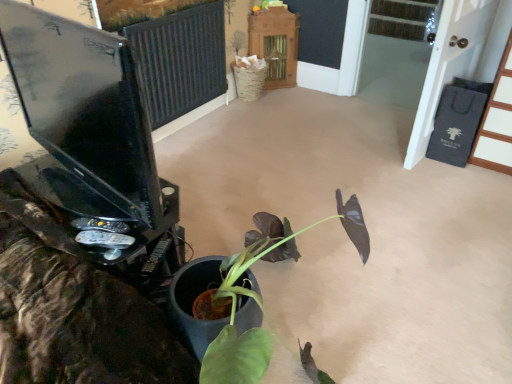
Image resolution: width=512 pixels, height=384 pixels. Describe the element at coordinates (497, 122) in the screenshot. I see `black wood door at upper right, which is the second furniture from back to front` at that location.

Locate an element on the screen. Image resolution: width=512 pixels, height=384 pixels. matte black monitor at left is located at coordinates (84, 105).

Consider the image. Is black wood door at upper right, the first furniture from the front, behind matte black monitor at left?

Yes, it is.

Is black wood door at upper right, which is the second furniture from back to front, at the right side of matte black monitor at left?

Correct, you'll find black wood door at upper right, which is the second furniture from back to front, to the right of matte black monitor at left.

From the image's perspective, between black wood door at upper right, the 1th furniture in the right-to-left sequence, and matte black monitor at left, who is located below?

matte black monitor at left is shown below in the image.

Which of these two, black wood door at upper right, placed as the second furniture when sorted from left to right, or matte black monitor at left, is smaller?

With smaller size is black wood door at upper right, placed as the second furniture when sorted from left to right.

Looking at this image, is wooden cabinet at upper center, positioned as the 2th furniture in front-to-back order, next to black fabric screen door at right and touching it?

No, wooden cabinet at upper center, positioned as the 2th furniture in front-to-back order, is not next to black fabric screen door at right.

In terms of size, does wooden cabinet at upper center, arranged as the first furniture when viewed from the left, appear bigger or smaller than black fabric screen door at right?

In the image, wooden cabinet at upper center, arranged as the first furniture when viewed from the left, appears to be smaller than black fabric screen door at right.

From a real-world perspective, who is located lower, wooden cabinet at upper center, positioned as the 2th furniture in front-to-back order, or black fabric screen door at right?

wooden cabinet at upper center, positioned as the 2th furniture in front-to-back order.

The image size is (512, 384). I want to click on screen door that appears on the right of wooden cabinet at upper center, arranged as the first furniture when viewed from the left, so click(459, 59).

Based on the photo, is black fabric screen door at right inside the boundaries of black wood door at upper right, placed as the second furniture when sorted from left to right, or outside?

black fabric screen door at right is spatially situated outside black wood door at upper right, placed as the second furniture when sorted from left to right.

Where is `furniture below the black fabric screen door at right (from the image's perspective)`? This screenshot has width=512, height=384. furniture below the black fabric screen door at right (from the image's perspective) is located at coordinates (497, 122).

Does black fabric screen door at right appear on the left side of black wood door at upper right, the 1th furniture in the right-to-left sequence?

Correct, you'll find black fabric screen door at right to the left of black wood door at upper right, the 1th furniture in the right-to-left sequence.

From a real-world perspective, which object rests below the other?

From a 3D spatial view, black wood door at upper right, which is the second furniture from back to front, is below.

Looking at this image, from the image's perspective, would you say matte black monitor at left is shown under black wood door at upper right, placed as the second furniture when sorted from left to right?

Yes, from the image's perspective, matte black monitor at left is beneath black wood door at upper right, placed as the second furniture when sorted from left to right.

Locate an element on the screen. This screenshot has width=512, height=384. computer monitor in front of the black wood door at upper right, the 1th furniture in the right-to-left sequence is located at coordinates (84, 105).

Considering the relative sizes of matte black monitor at left and black wood door at upper right, placed as the second furniture when sorted from left to right, in the image provided, is matte black monitor at left taller than black wood door at upper right, placed as the second furniture when sorted from left to right,?

No, matte black monitor at left is not taller than black wood door at upper right, placed as the second furniture when sorted from left to right.

Can we say matte black monitor at left lies outside black wood door at upper right, placed as the second furniture when sorted from left to right?

Absolutely, matte black monitor at left is external to black wood door at upper right, placed as the second furniture when sorted from left to right.

Looking at their sizes, would you say black wood door at upper right, which is the second furniture from back to front, is wider or thinner than black fabric screen door at right?

Clearly, black wood door at upper right, which is the second furniture from back to front, has more width compared to black fabric screen door at right.

Could black fabric screen door at right be considered to be inside black wood door at upper right, which is the second furniture from back to front?

No.

From the image's perspective, is black wood door at upper right, which is the second furniture from back to front, located above black fabric screen door at right?

No.

Find the location of a particular element. Image resolution: width=512 pixels, height=384 pixels. computer monitor in front of the wooden cabinet at upper center, arranged as the first furniture when viewed from the left is located at coordinates (84, 105).

Looking at the image, does matte black monitor at left seem bigger or smaller compared to wooden cabinet at upper center, arranged as the 2th furniture when viewed from the right?

Considering their sizes, matte black monitor at left takes up more space than wooden cabinet at upper center, arranged as the 2th furniture when viewed from the right.

Which is more to the left, matte black monitor at left or wooden cabinet at upper center, positioned as the 2th furniture in front-to-back order?

matte black monitor at left is more to the left.

From a real-world perspective, is matte black monitor at left over wooden cabinet at upper center, arranged as the 2th furniture when viewed from the right?

Yes, from a real-world perspective, matte black monitor at left is above wooden cabinet at upper center, arranged as the 2th furniture when viewed from the right.

From a real-world perspective, is wooden cabinet at upper center, marked as the 1th furniture in a back-to-front arrangement, physically above black wood door at upper right, placed as the second furniture when sorted from left to right?

Incorrect, from a real-world perspective, wooden cabinet at upper center, marked as the 1th furniture in a back-to-front arrangement, is lower than black wood door at upper right, placed as the second furniture when sorted from left to right.

Is the position of wooden cabinet at upper center, arranged as the first furniture when viewed from the left, less distant than that of black wood door at upper right, placed as the second furniture when sorted from left to right?

No, wooden cabinet at upper center, arranged as the first furniture when viewed from the left, is behind black wood door at upper right, placed as the second furniture when sorted from left to right.

How different are the orientations of wooden cabinet at upper center, arranged as the 2th furniture when viewed from the right, and black wood door at upper right, placed as the second furniture when sorted from left to right, in degrees?

wooden cabinet at upper center, arranged as the 2th furniture when viewed from the right, and black wood door at upper right, placed as the second furniture when sorted from left to right, are facing 35.1 degrees away from each other.

Does wooden cabinet at upper center, positioned as the 2th furniture in front-to-back order, have a greater height compared to black wood door at upper right, placed as the second furniture when sorted from left to right?

No, wooden cabinet at upper center, positioned as the 2th furniture in front-to-back order, is not taller than black wood door at upper right, placed as the second furniture when sorted from left to right.

Identify the location of computer monitor on the left of black wood door at upper right, the 1th furniture in the right-to-left sequence. (84, 105).

Identify the location of the 2nd furniture directly beneath the black fabric screen door at right (from a real-world perspective). This screenshot has width=512, height=384. (275, 44).

Consider the image. Looking at the image, which one is located closer to wooden cabinet at upper center, positioned as the 2th furniture in front-to-back order, black wood door at upper right, the 1th furniture in the right-to-left sequence, or matte black monitor at left?

black wood door at upper right, the 1th furniture in the right-to-left sequence, is closer to wooden cabinet at upper center, positioned as the 2th furniture in front-to-back order.

Considering their positions, is wooden cabinet at upper center, marked as the 1th furniture in a back-to-front arrangement, positioned further to matte black monitor at left than black fabric screen door at right?

wooden cabinet at upper center, marked as the 1th furniture in a back-to-front arrangement, is positioned further to the anchor matte black monitor at left.

Looking at the image, which one is located further to matte black monitor at left, black fabric screen door at right or wooden cabinet at upper center, arranged as the first furniture when viewed from the left?

The object further to matte black monitor at left is wooden cabinet at upper center, arranged as the first furniture when viewed from the left.

Based on their spatial positions, is black fabric screen door at right or matte black monitor at left closer to wooden cabinet at upper center, arranged as the first furniture when viewed from the left?

black fabric screen door at right is positioned closer to the anchor wooden cabinet at upper center, arranged as the first furniture when viewed from the left.

Looking at the image, which one is located further to black fabric screen door at right, matte black monitor at left or wooden cabinet at upper center, arranged as the first furniture when viewed from the left?

matte black monitor at left is further to black fabric screen door at right.

Looking at the image, which one is located further to matte black monitor at left, black fabric screen door at right or black wood door at upper right, which is the second furniture from back to front?

black wood door at upper right, which is the second furniture from back to front, lies further to matte black monitor at left than the other object.

Estimate the real-world distances between objects in this image. Which object is closer to black wood door at upper right, the first furniture from the front, black fabric screen door at right or matte black monitor at left?

Among the two, black fabric screen door at right is located nearer to black wood door at upper right, the first furniture from the front.

Estimate the real-world distances between objects in this image. Which object is closer to black wood door at upper right, placed as the second furniture when sorted from left to right, wooden cabinet at upper center, positioned as the 2th furniture in front-to-back order, or black fabric screen door at right?

black fabric screen door at right is positioned closer to the anchor black wood door at upper right, placed as the second furniture when sorted from left to right.

Where is `screen door between matte black monitor at left and black wood door at upper right, the first furniture from the front, from left to right`? The width and height of the screenshot is (512, 384). screen door between matte black monitor at left and black wood door at upper right, the first furniture from the front, from left to right is located at coordinates (459, 59).

The height and width of the screenshot is (384, 512). I want to click on screen door between matte black monitor at left and wooden cabinet at upper center, arranged as the first furniture when viewed from the left, from front to back, so click(459, 59).

This screenshot has width=512, height=384. In order to click on furniture between matte black monitor at left and wooden cabinet at upper center, marked as the 1th furniture in a back-to-front arrangement, along the z-axis in this screenshot , I will do `click(497, 122)`.

Where is `screen door between wooden cabinet at upper center, arranged as the 2th furniture when viewed from the right, and black wood door at upper right, the 1th furniture in the right-to-left sequence, in the horizontal direction`? This screenshot has height=384, width=512. screen door between wooden cabinet at upper center, arranged as the 2th furniture when viewed from the right, and black wood door at upper right, the 1th furniture in the right-to-left sequence, in the horizontal direction is located at coordinates (459, 59).